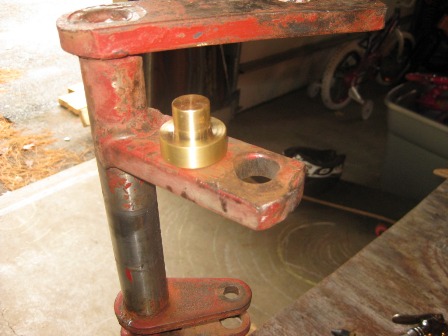
This screenshot has height=336, width=448. I want to click on wooden table, so click(x=413, y=287).